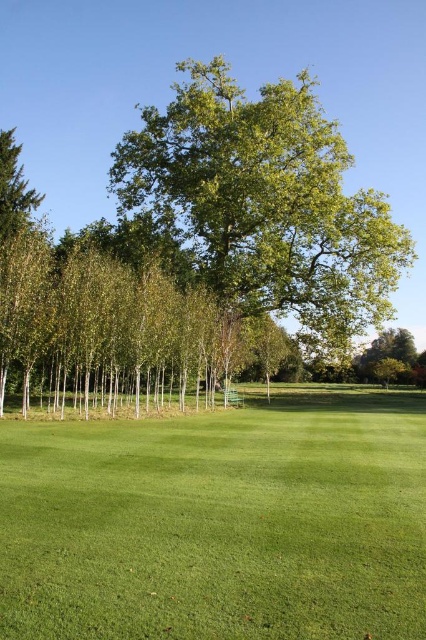
What do you see at coordinates (219, 522) in the screenshot?
I see `green grass at lower center` at bounding box center [219, 522].

Is the position of green grass at lower center less distant than that of green leafy tree at center?

That is True.

Identify the location of green grass at lower center. (219, 522).